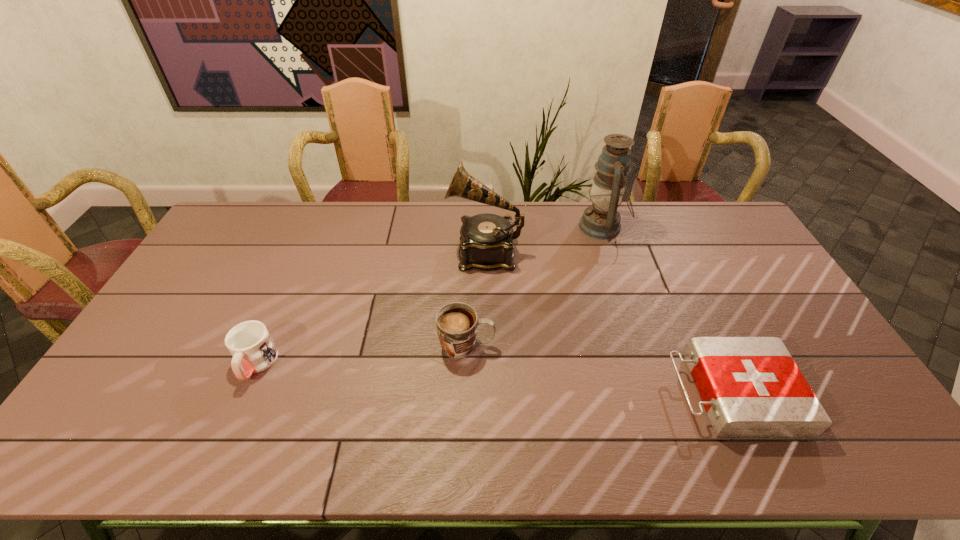
This screenshot has width=960, height=540. Identify the location of object located at the near right corner. (751, 388).

Image resolution: width=960 pixels, height=540 pixels. I want to click on vacant area at the far edge of the desktop, so click(660, 220).

Find the location of a particular element. vacant space at the left edge is located at coordinates (208, 289).

Find the location of a particular element. This screenshot has width=960, height=540. free space at the right edge of the desktop is located at coordinates (733, 243).

Where is `vacant point at the far left corner`? The image size is (960, 540). vacant point at the far left corner is located at coordinates (251, 211).

You are a GUI agent. You are given a task and a screenshot of the screen. Output one action in this format:
    pyautogui.click(x=<x>, y=<y>)
    Task: Click on the free space that is in between the shortest object and the right mug
    
    Given the screenshot: What is the action you would take?
    pyautogui.click(x=600, y=370)

Where is `vacant area that lies between the shortest object and the phonograph record`? This screenshot has width=960, height=540. vacant area that lies between the shortest object and the phonograph record is located at coordinates (609, 323).

Find the location of a particular element. vacant space that's between the leftmost object and the phonograph record is located at coordinates (371, 308).

Image resolution: width=960 pixels, height=540 pixels. I want to click on vacant area that lies between the shortest object and the oil lamp, so click(x=667, y=310).

The width and height of the screenshot is (960, 540). In order to click on free space that is in between the oil lamp and the fourth tallest object in this screenshot , I will do `click(429, 295)`.